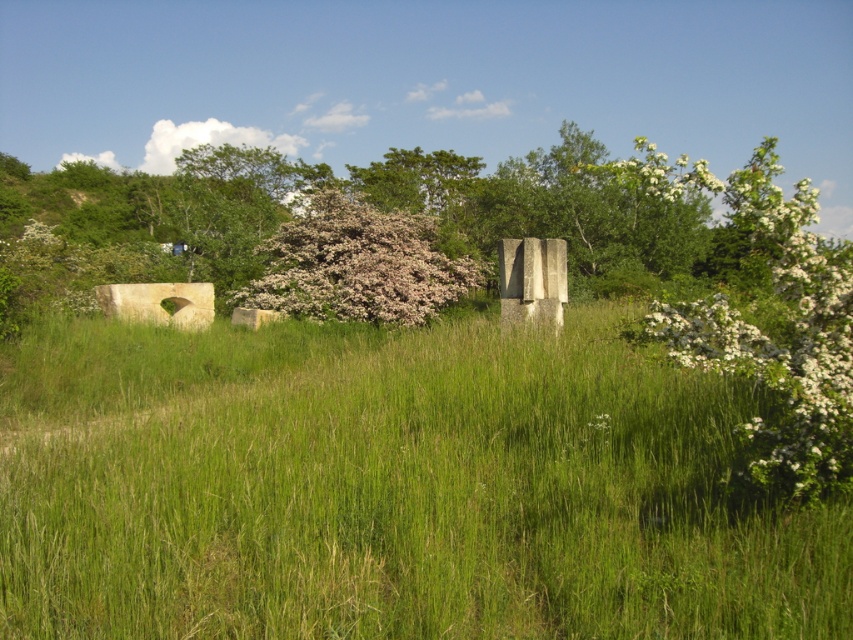
You are standing in the middle of the green grass at center and want to pick the fluffy white blossoms at center. Can you reach them without bending down?

The green grass at center is shorter than the fluffy white blossoms at center, so you would need to bend down to reach them since the blossoms are taller than the grass.

You are standing in the middle of the grassy field and notice both the green grass at center and the fluffy white blossoms at center. Which object is closer to you?

The green grass at center is closer to you since it is in front of the fluffy white blossoms at center.

You are a gardener observing the scene. You notice the green grass at center and the fluffy white blossoms at center. Which of these two has a greater width?

The green grass at center has a greater width than the fluffy white blossoms at center.